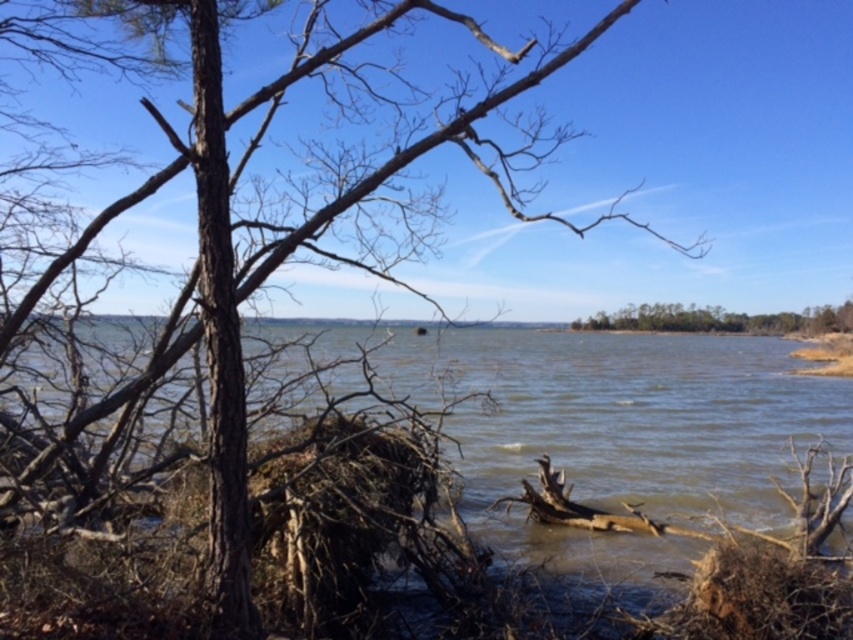
You are a kayaker planning to paddle near the green leafy tree at center. Based on the scene, where would you expect to find the brown muddy water at center in relation to the tree?

The brown muddy water at center is positioned under the green leafy tree at center, so you would find it directly beneath the tree.

You are a kayaker planning to navigate through the center of the lake. You see the brown muddy water at center and the green leafy tree at center. Which one is wider in terms of spatial coverage?

The brown muddy water at center is wider than the green leafy tree at center according to the description provided.

You are standing at the lakeside and want to cross to the other side. You see the brown muddy water at center and the green leafy tree at center. Which one is taller and could potentially block your view?

The brown muddy water at center is much taller than the green leafy tree at center, so it might block your view more effectively.